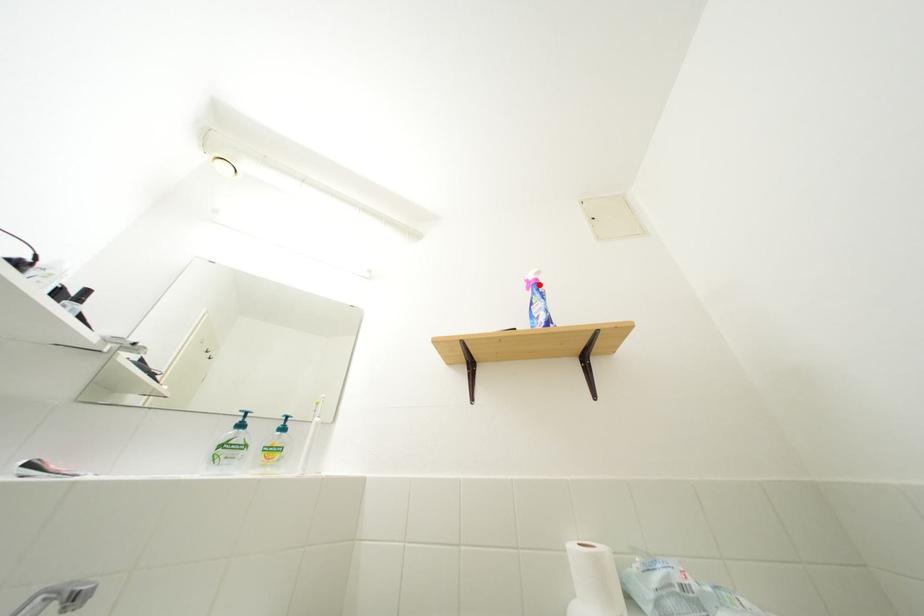
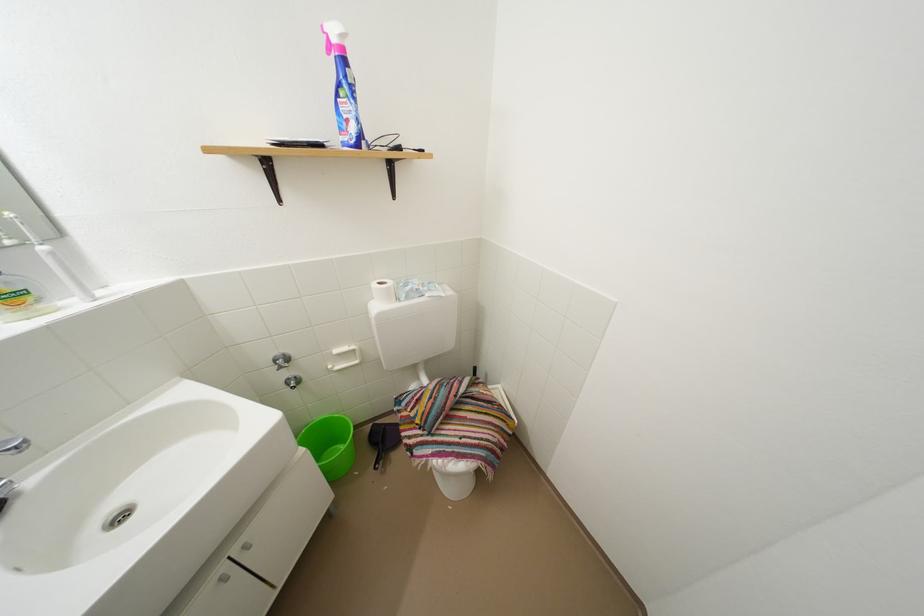
In the second image, find the point that corresponds to the highlighted location in the first image.

(342, 45)